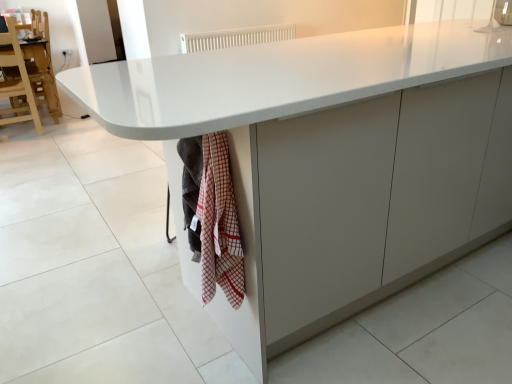
Question: Can you confirm if white plastic radiator at upper center is smaller than wooden chair at left?

Choices:
 (A) no
 (B) yes

Answer: (B)

Question: Does white plastic radiator at upper center have a greater height compared to wooden chair at left?

Choices:
 (A) yes
 (B) no

Answer: (B)

Question: Is white plastic radiator at upper center located outside wooden chair at left?

Choices:
 (A) no
 (B) yes

Answer: (B)

Question: From a real-world perspective, is white plastic radiator at upper center on top of wooden chair at left?

Choices:
 (A) no
 (B) yes

Answer: (B)

Question: From a real-world perspective, is white plastic radiator at upper center positioned under wooden chair at left based on gravity?

Choices:
 (A) yes
 (B) no

Answer: (B)

Question: Is white plastic radiator at upper center beside wooden chair at left?

Choices:
 (A) no
 (B) yes

Answer: (A)

Question: Can you confirm if white glossy granite at lower left is taller than white plastic radiator at upper center?

Choices:
 (A) no
 (B) yes

Answer: (A)

Question: Can you confirm if white glossy granite at lower left is positioned to the left of white plastic radiator at upper center?

Choices:
 (A) yes
 (B) no

Answer: (A)

Question: Are white glossy granite at lower left and white plastic radiator at upper center making contact?

Choices:
 (A) no
 (B) yes

Answer: (A)

Question: Considering the relative positions of white glossy granite at lower left and white plastic radiator at upper center in the image provided, is white glossy granite at lower left to the right of white plastic radiator at upper center from the viewer's perspective?

Choices:
 (A) no
 (B) yes

Answer: (A)

Question: Can you confirm if white glossy granite at lower left is bigger than white plastic radiator at upper center?

Choices:
 (A) no
 (B) yes

Answer: (A)

Question: From a real-world perspective, is white glossy granite at lower left below white plastic radiator at upper center?

Choices:
 (A) no
 (B) yes

Answer: (B)

Question: Does wooden chair at left lie in front of white glossy granite at lower left?

Choices:
 (A) yes
 (B) no

Answer: (B)